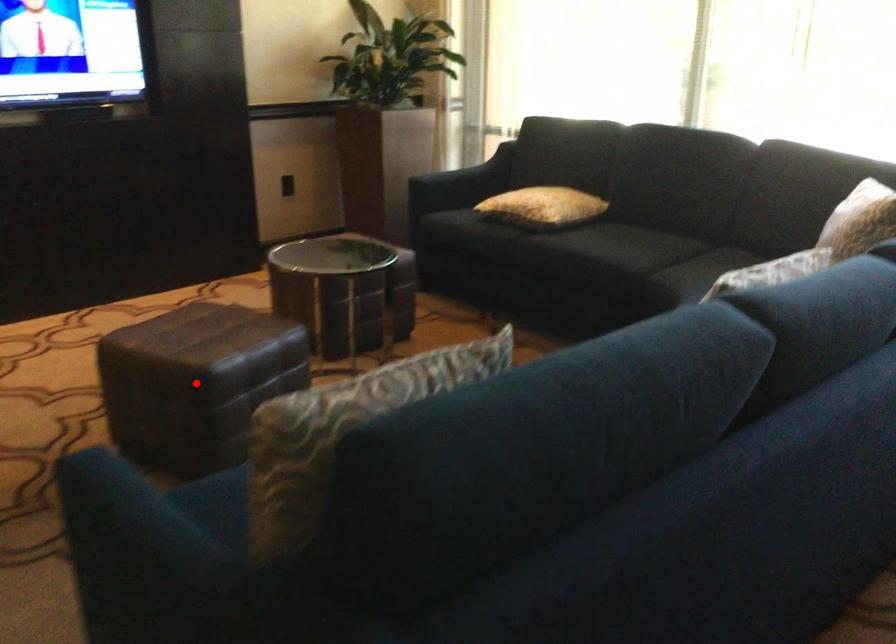
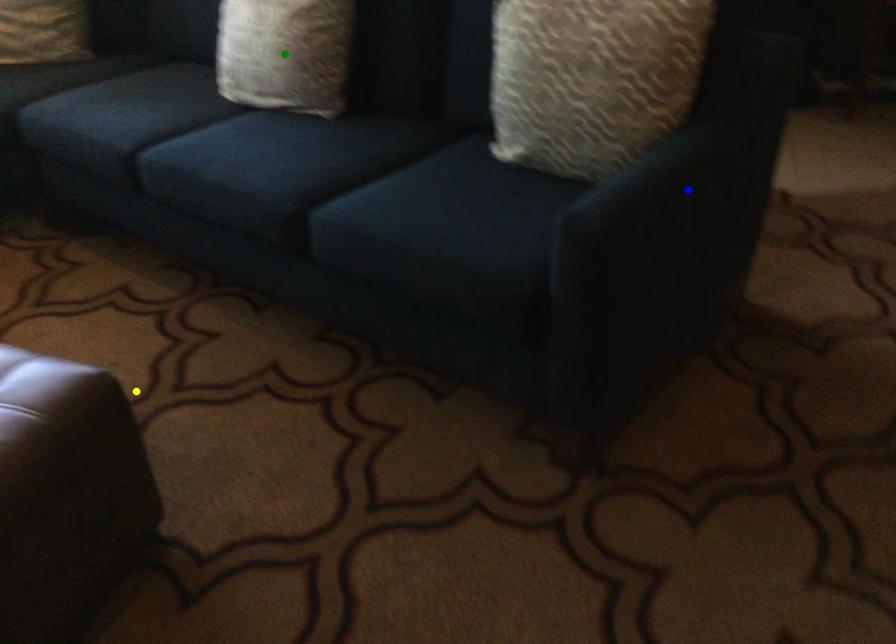
Question: I am providing you with two images of the same scene from different viewpoints. A red point is marked on the first image. You are given multiple points on the second image. Which mark in image 2 goes with the point in image 1?

Choices:
 (A) yellow point
 (B) blue point
 (C) green point

Answer: (A)